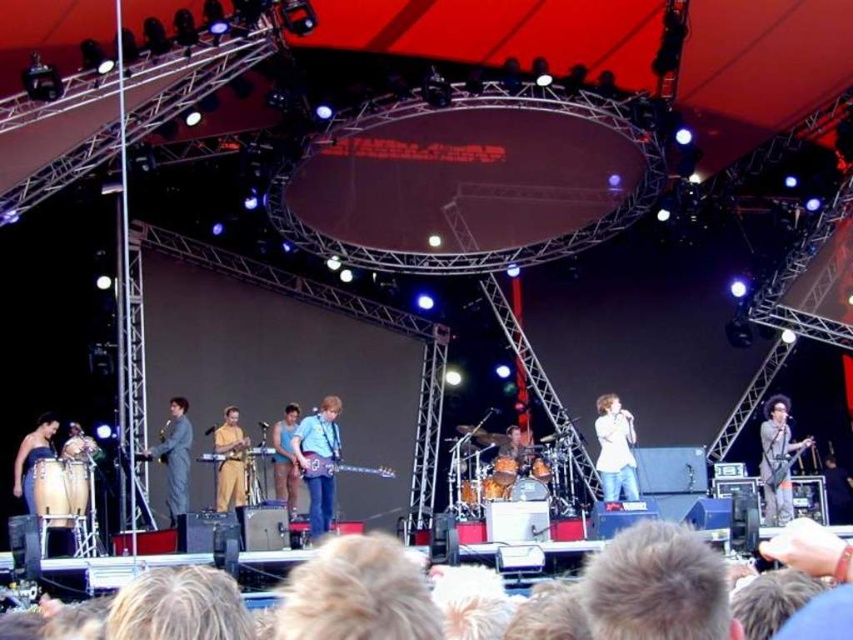
Which is in front, point (283, 458) or point (300, 472)?

Point (300, 472) is more forward.

Between blue fabric shirt at center and metallic electric guitar at center, which one appears on the right side from the viewer's perspective?

From the viewer's perspective, metallic electric guitar at center appears more on the right side.

Who is more forward, (286, 448) or (311, 472)?

Point (311, 472) is in front.

Locate an element on the screen. This screenshot has height=640, width=853. blue fabric shirt at center is located at coordinates (285, 458).

Based on the photo, who is taller, matte brown drum at lower left or blue fabric shirt at center?

With more height is blue fabric shirt at center.

Which is below, matte brown drum at lower left or blue fabric shirt at center?

blue fabric shirt at center

Which is in front, point (53, 426) or point (285, 406)?

Positioned in front is point (53, 426).

This screenshot has height=640, width=853. What are the coordinates of `matte brown drum at lower left` in the screenshot? It's located at (33, 458).

Looking at this image, is purple glossy guitar at center to the left of blue fabric shirt at center from the viewer's perspective?

Incorrect, purple glossy guitar at center is not on the left side of blue fabric shirt at center.

Can you confirm if purple glossy guitar at center is taller than blue fabric shirt at center?

Indeed, purple glossy guitar at center has a greater height compared to blue fabric shirt at center.

Does point (315, 433) come farther from viewer compared to point (287, 403)?

No, it is not.

Find the location of a particular element. The width and height of the screenshot is (853, 640). purple glossy guitar at center is located at coordinates (318, 461).